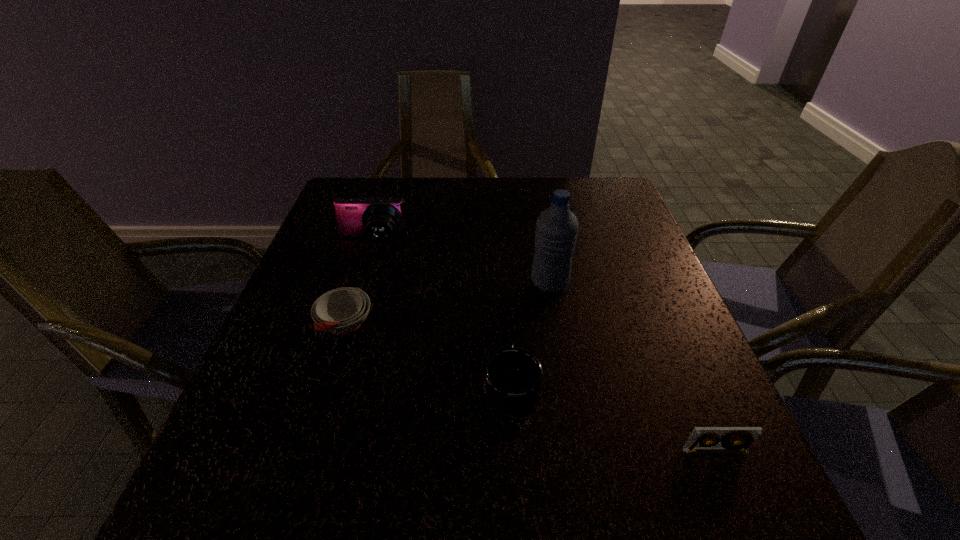
This screenshot has height=540, width=960. Find the location of `the second object from right to left`. the second object from right to left is located at coordinates tap(557, 227).

Identify the location of the fourth nearest object. This screenshot has height=540, width=960. (557, 227).

What are the coordinates of `the farthest object` in the screenshot? It's located at (379, 219).

Identify the location of camera. The height and width of the screenshot is (540, 960). (379, 219).

This screenshot has width=960, height=540. Find the location of `the nearest object`. the nearest object is located at coordinates (737, 439).

Where is `videotape`? The height and width of the screenshot is (540, 960). videotape is located at coordinates (737, 439).

Where is `mug`? mug is located at coordinates (512, 377).

Identify the location of the second nearest object. The height and width of the screenshot is (540, 960). (512, 377).

The height and width of the screenshot is (540, 960). Find the location of `soup bowl`. soup bowl is located at coordinates (341, 311).

Find the location of a particular element. vacant area situated on the back of the fourth object from left to right is located at coordinates (537, 211).